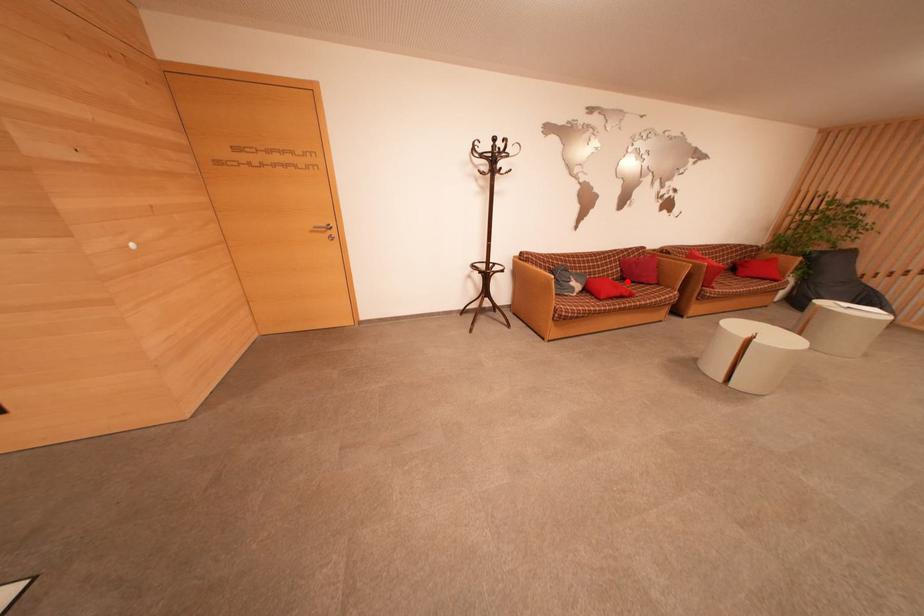
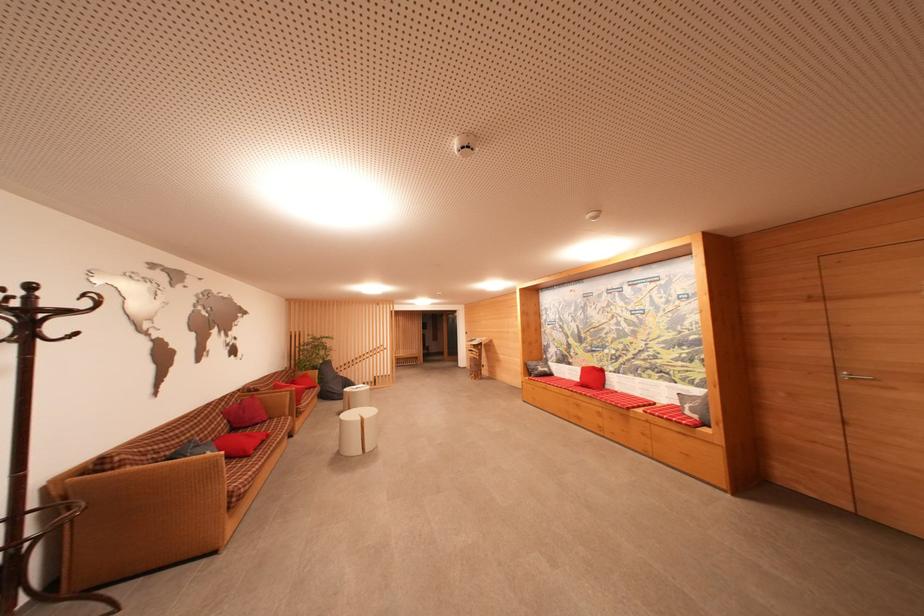
Question: A red point is marked in image1. In image2, is the corresponding 3D point closer to the camera or farther? Reply with the corresponding letter.

Choices:
 (A) The corresponding 3D point is closer.
 (B) The corresponding 3D point is farther.

Answer: (B)